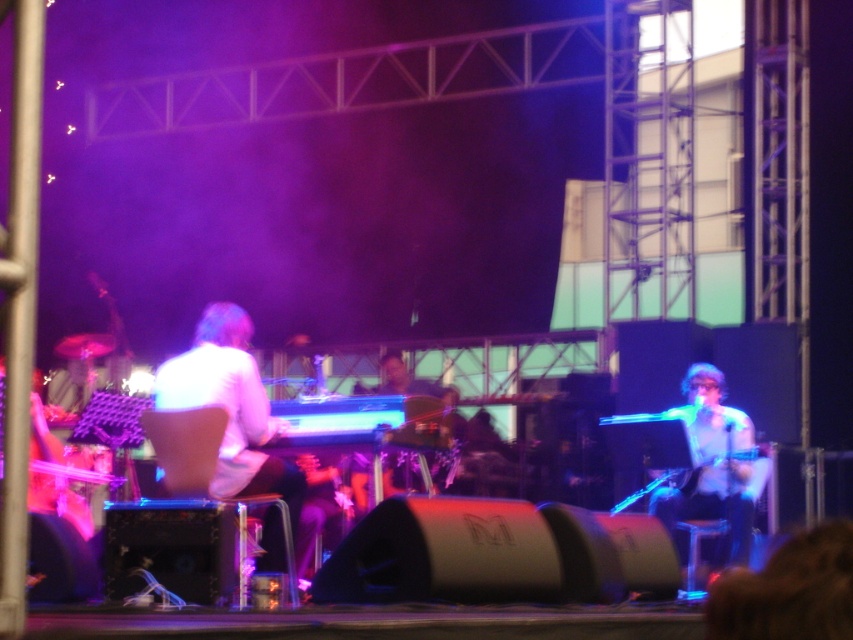
You are a stagehand who needs to adjust the white glossy microphone at center so that it is exactly 10 feet away from the white matte keyboardist at center. Currently, the microphone is positioned closer than required. In which direction should you move the microphone to achieve the desired distance?

The white glossy microphone at center is currently 9.28 feet away from the white matte keyboardist at center. To increase the distance to 10 feet, move the microphone away from the keyboardist.

In the scene shown: You are a stagehand adjusting the lighting for the performance. You need to ensure that the white glossy microphone at center is not obscured by the white matte keyboardist at center. Given their heights, which object should you position lower to avoid blocking the microphone?

Since the white matte keyboardist at center is taller than the white glossy microphone at center, you should lower the white matte keyboardist at center to ensure the microphone remains visible.

You are a stagehand positioned at the center of the stage. You need to move the white matte keyboardist at center to the left side of the stage. Which direction should you move them relative to your current position?

Since the white matte keyboardist at center is located at point 0.647 on the x coordinate, which is to the right of the center point 0.5, you should move them to the left to reach the left side of the stage.